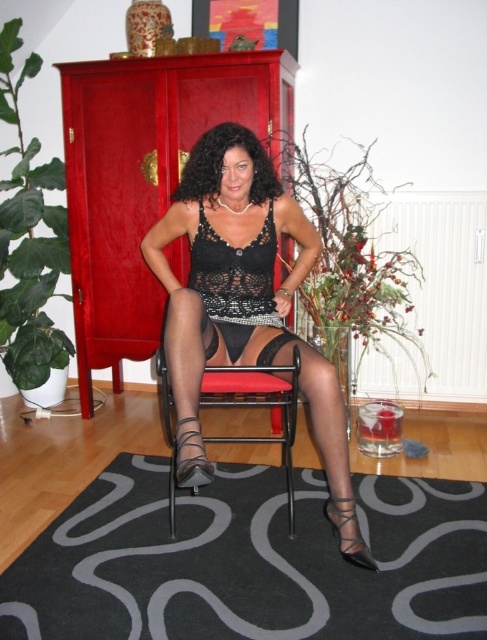
What is located at the coordinates point (238,292) in the image?

The coordinates point (238,292) in the image correspond to the location of the black lace lingerie at center.

You are a delivery person trying to place a package on the floor between the red wood armoire at left and the black sheer stocking at lower center. Is there enough space between them for the package?

The red wood armoire at left is to the left of the black sheer stocking at lower center, so there is space between them for the package.